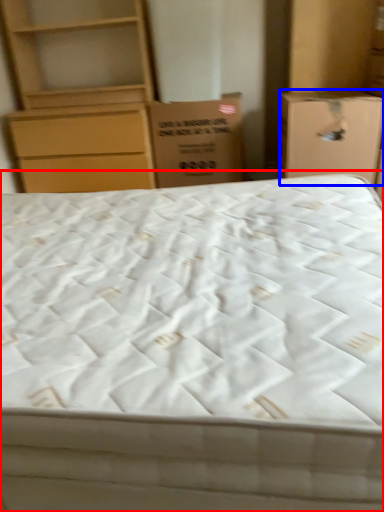
Question: Which object appears farthest to the camera in this image, bed (highlighted by a red box) or cardboard box (highlighted by a blue box)?

Choices:
 (A) bed
 (B) cardboard box

Answer: (B)